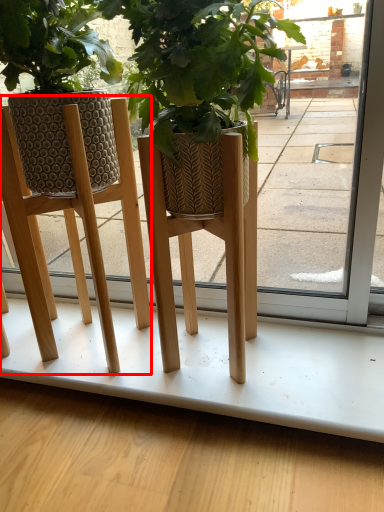
Question: From the image's perspective, where is furniture (annotated by the red box) located relative to pavement?

Choices:
 (A) below
 (B) above

Answer: (B)